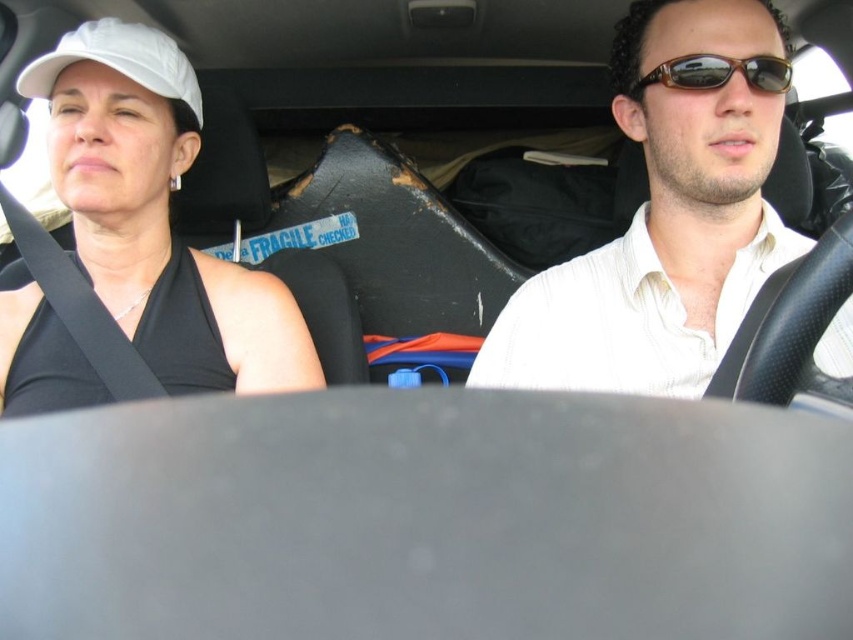
Question: Does matte black tank top at left have a greater width compared to white matte baseball cap at upper left?

Choices:
 (A) yes
 (B) no

Answer: (A)

Question: Which of the following is the farthest from the observer?

Choices:
 (A) white shirt at center
 (B) brown tortoiseshell sunglasses at upper center

Answer: (B)

Question: Which object is positioned closest to the matte black tank top at left?

Choices:
 (A) white matte baseball cap at upper left
 (B) brown tortoiseshell sunglasses at upper center

Answer: (A)

Question: Does matte black tank top at left have a lesser width compared to white matte baseball cap at upper left?

Choices:
 (A) no
 (B) yes

Answer: (A)

Question: Among these objects, which one is nearest to the camera?

Choices:
 (A) matte black tank top at left
 (B) brown tortoiseshell sunglasses at upper center
 (C) white matte baseball cap at upper left
 (D) white shirt at center

Answer: (D)

Question: Does white shirt at center have a larger size compared to brown tortoiseshell sunglasses at upper center?

Choices:
 (A) no
 (B) yes

Answer: (B)